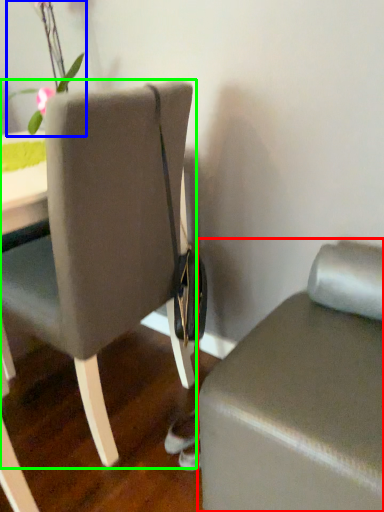
Question: Which is farther away from furniture (highlighted by a red box)? floral arrangement (highlighted by a blue box) or chair (highlighted by a green box)?

Choices:
 (A) floral arrangement
 (B) chair

Answer: (A)